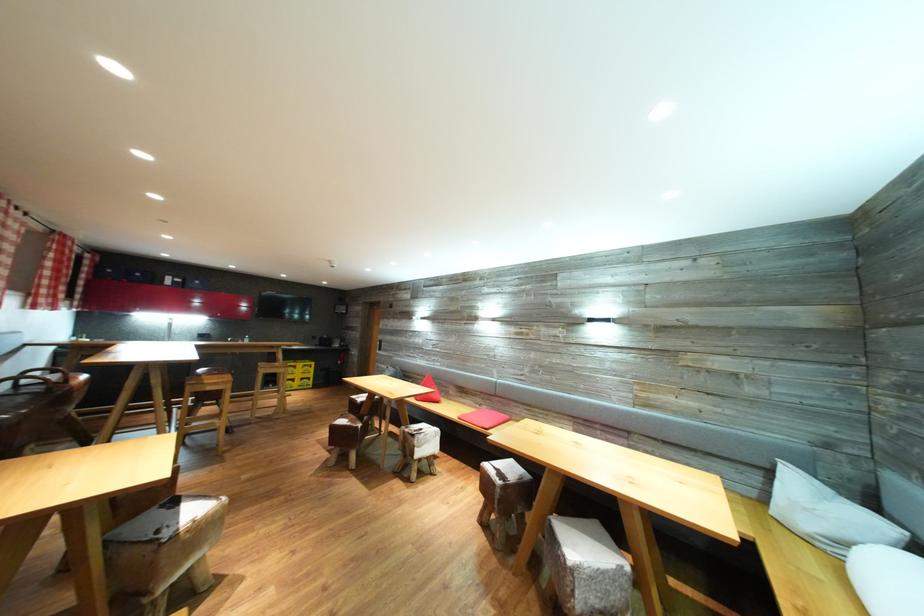
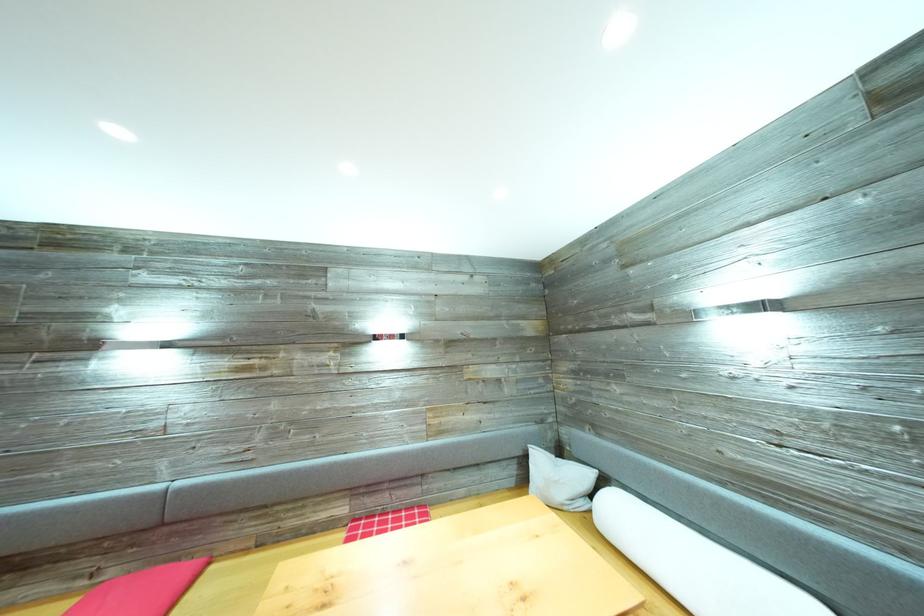
In the second image, find the point that corresponds to point (491, 411) in the first image.

(117, 578)